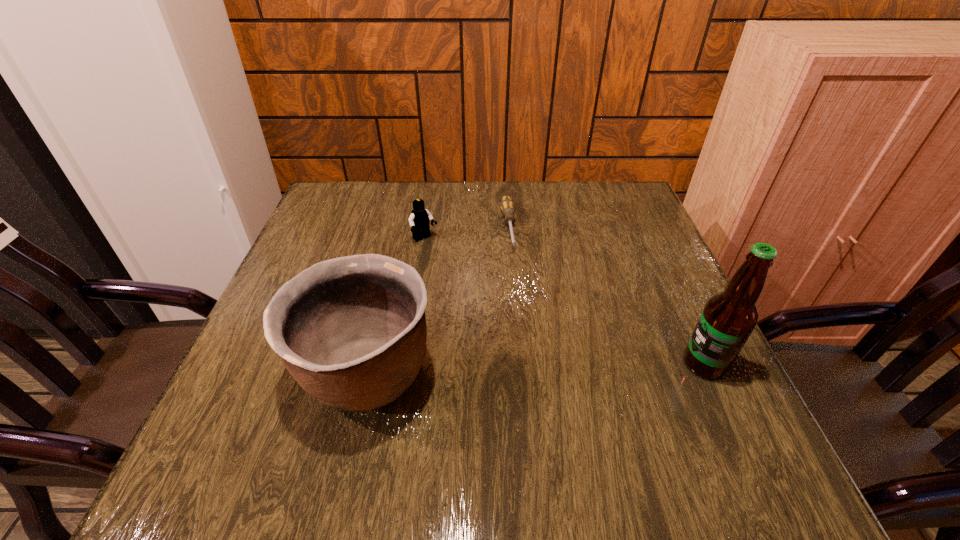
I want to click on empty space between the second tallest object and the tallest object, so click(536, 369).

What are the coordinates of `vacant area between the beer bottle and the shortest object` in the screenshot? It's located at (607, 295).

The width and height of the screenshot is (960, 540). I want to click on free point between the Lego and the beer bottle, so click(564, 301).

Where is `vacant region between the screwdriver and the pottery`? This screenshot has width=960, height=540. vacant region between the screwdriver and the pottery is located at coordinates (438, 300).

This screenshot has height=540, width=960. Identify the location of object that is the second closest to the tallest object. (351, 330).

Where is `the closest object to the screwdriver`? This screenshot has height=540, width=960. the closest object to the screwdriver is located at coordinates (419, 220).

This screenshot has width=960, height=540. What are the coordinates of `vacant space that satisfies the following two spatial constraints: 1. on the back side of the beer bottle; 2. on the label of the second tallest object` in the screenshot? It's located at (369, 364).

The height and width of the screenshot is (540, 960). I want to click on free spot that satisfies the following two spatial constraints: 1. on the back side of the pottery; 2. on the label of the beer bottle, so click(x=369, y=364).

Find the location of `free location that satisfies the following two spatial constraints: 1. on the back side of the screwdriver; 2. on the left side of the second shortest object`. free location that satisfies the following two spatial constraints: 1. on the back side of the screwdriver; 2. on the left side of the second shortest object is located at coordinates (426, 227).